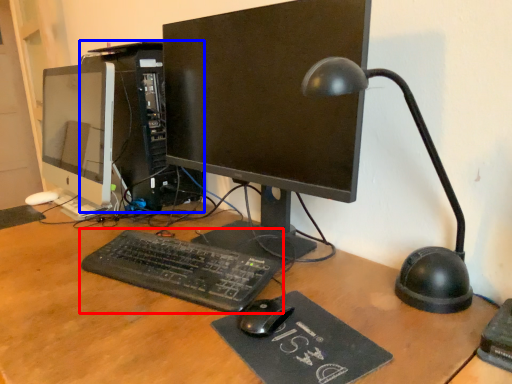
Question: Among these objects, which one is farthest to the camera, computer keyboard (highlighted by a red box) or computer tower (highlighted by a blue box)?

Choices:
 (A) computer keyboard
 (B) computer tower

Answer: (B)